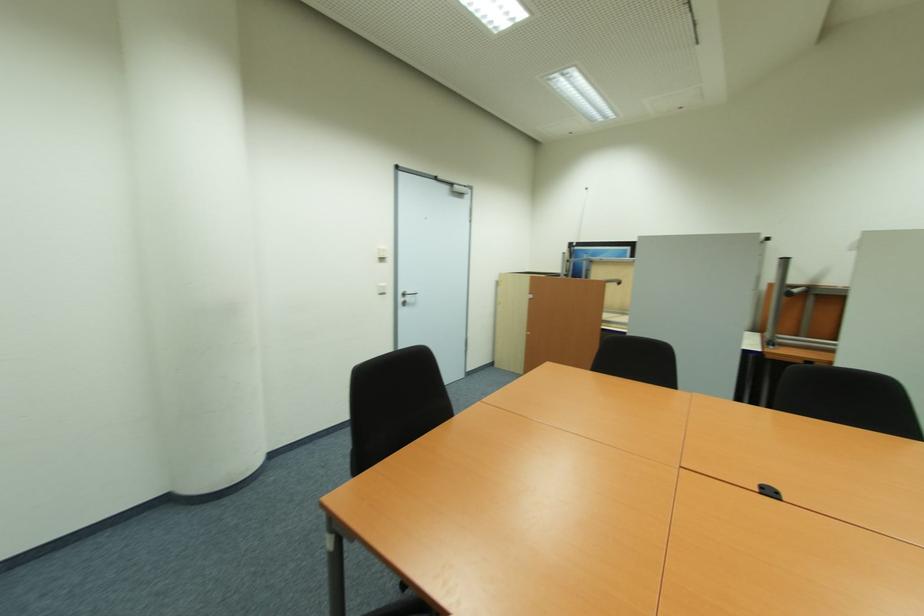
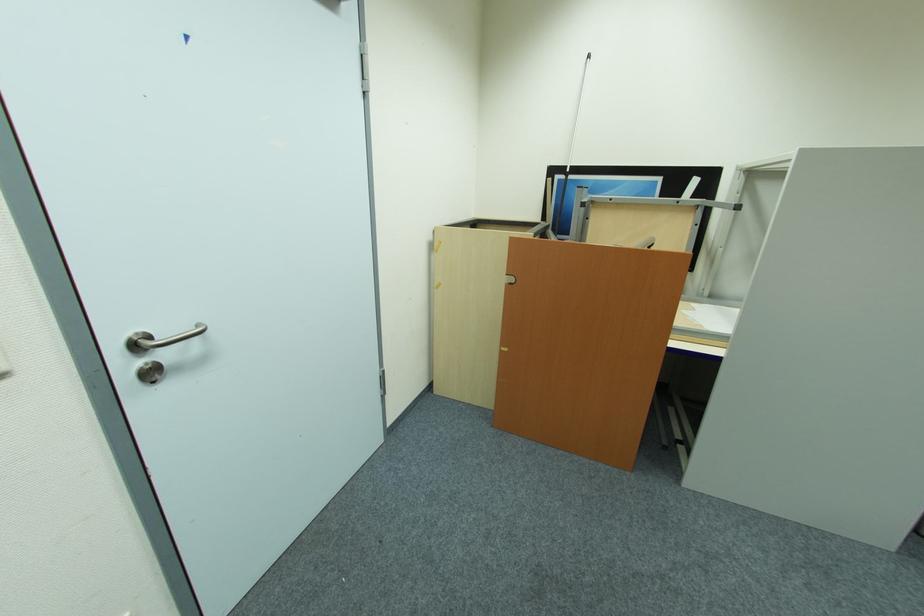
Locate, in the second image, the point that corresponds to (407,294) in the first image.

(141, 347)